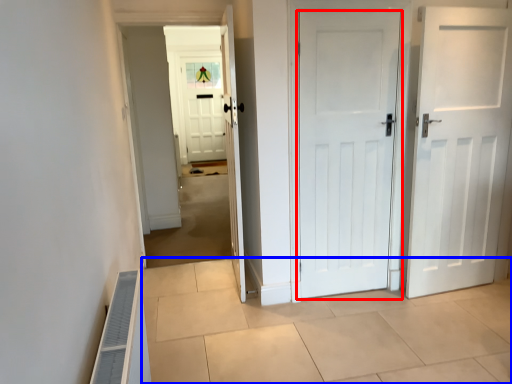
Question: Which of the following is the closest to the observer, door (highlighted by a red box) or path (highlighted by a blue box)?

Choices:
 (A) door
 (B) path

Answer: (B)